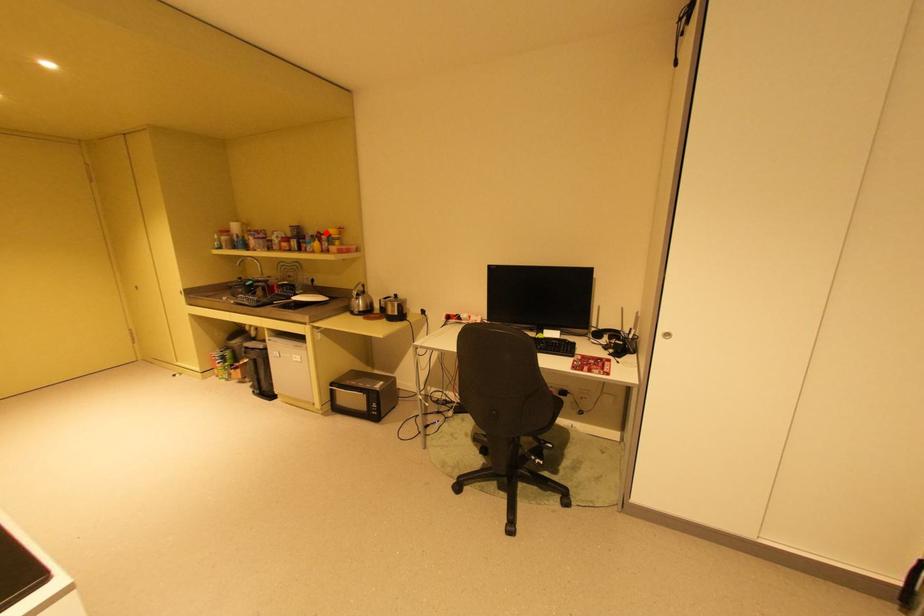
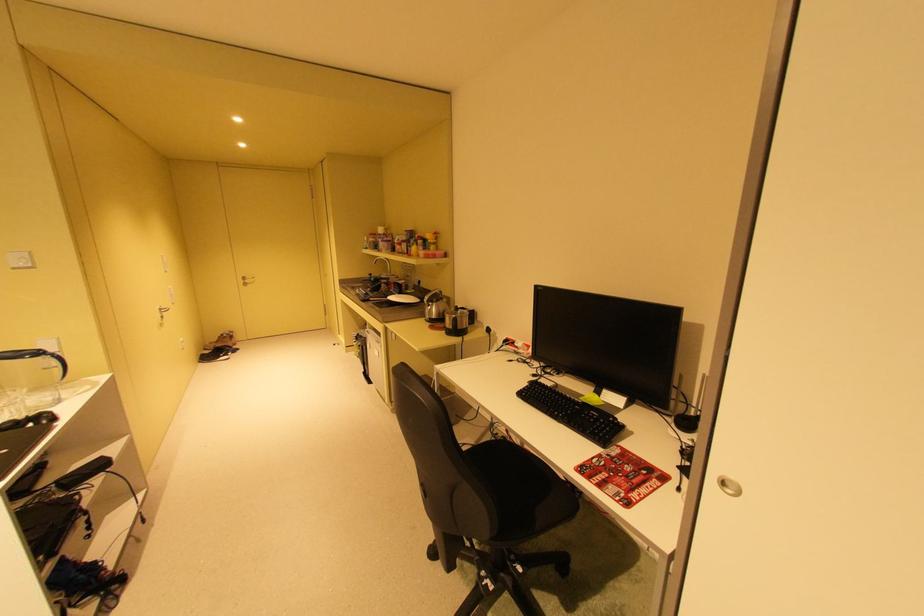
In the second image, find the point that corresponds to the highlighted location in the first image.

(428, 237)